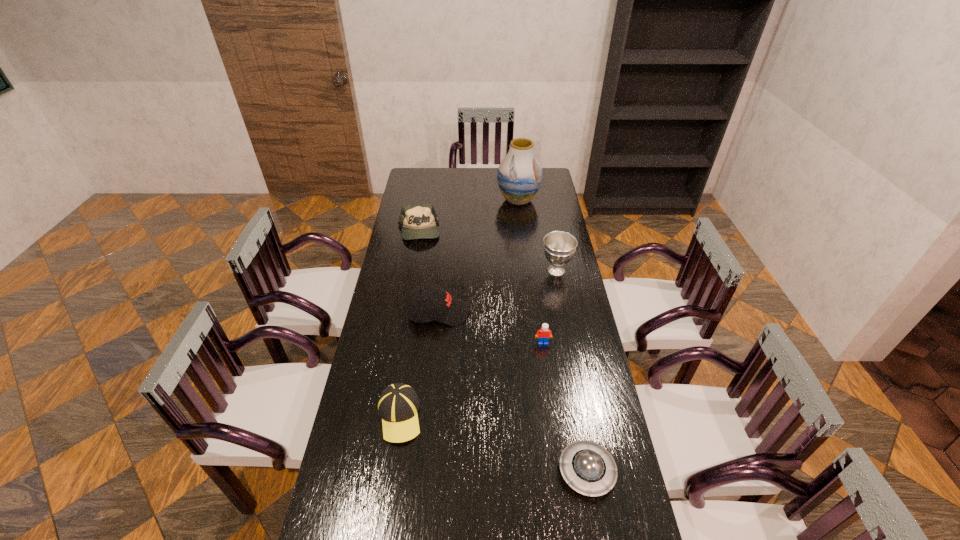
Image resolution: width=960 pixels, height=540 pixels. What are the coordinates of `blank space located 0.230m on the left of the tallest object` in the screenshot? It's located at (453, 200).

Where is `free space located on the front of the sixth shortest object`? The width and height of the screenshot is (960, 540). free space located on the front of the sixth shortest object is located at coordinates (571, 345).

Where is `blank area located on the front-facing side of the tallest baseball cap`? This screenshot has height=540, width=960. blank area located on the front-facing side of the tallest baseball cap is located at coordinates (510, 313).

What are the coordinates of `vacant region located on the face of the Lego` in the screenshot? It's located at (545, 363).

The image size is (960, 540). I want to click on free space located 0.380m on the front-facing side of the farthest baseball cap, so (406, 302).

Identify the location of free space located 0.140m with the brim of the nearest baseball cap facing forward. (388, 493).

Where is `vacant region located 0.370m on the left of the saucer`? vacant region located 0.370m on the left of the saucer is located at coordinates (431, 471).

The height and width of the screenshot is (540, 960). What are the coordinates of `object that is at the far edge` in the screenshot? It's located at (519, 175).

Locate an element on the screen. The image size is (960, 540). vase that is at the right edge is located at coordinates (519, 175).

You are a GUI agent. You are given a task and a screenshot of the screen. Output one action in this format:
    pyautogui.click(x=<x>, y=<y>)
    Task: Click on the chalice at the right edge
    The image size is (960, 540).
    Given the screenshot: What is the action you would take?
    pyautogui.click(x=559, y=247)